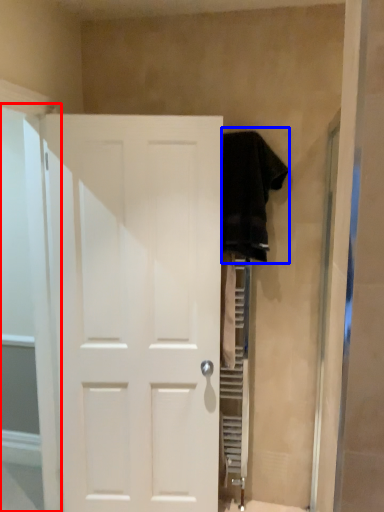
Question: Which object is closer to the camera taking this photo, glass door (highlighted by a red box) or clothing (highlighted by a blue box)?

Choices:
 (A) glass door
 (B) clothing

Answer: (A)